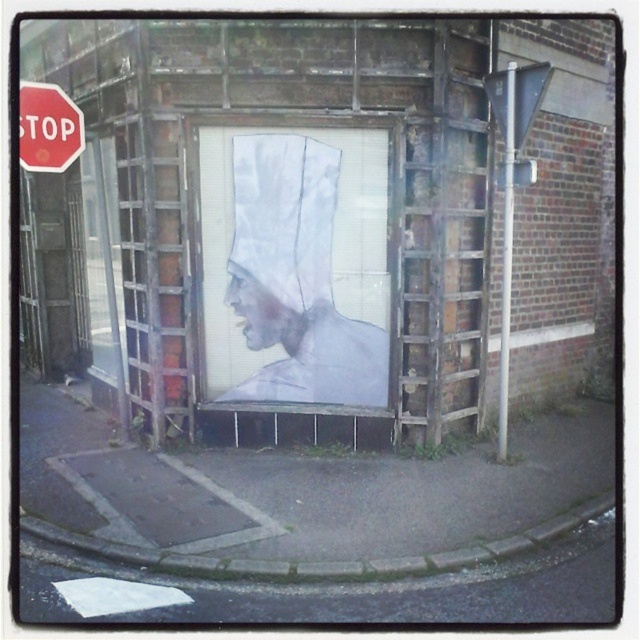
Which of these two, white paper bag at center or red plastic stop sign at upper left, stands shorter?

red plastic stop sign at upper left is shorter.

Which is below, white paper bag at center or red plastic stop sign at upper left?

white paper bag at center is below.

Who is more forward, (x=241, y=170) or (x=51, y=109)?

Point (x=51, y=109)

Locate an element on the screen. This screenshot has height=640, width=640. white paper bag at center is located at coordinates (296, 278).